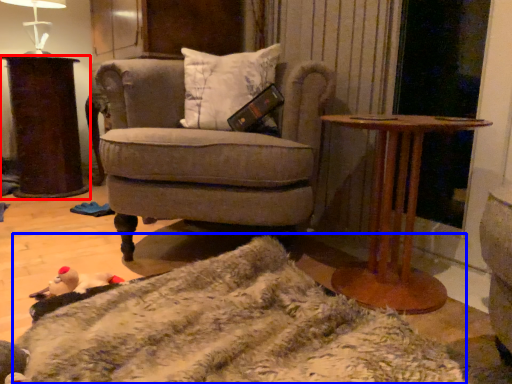
Question: Which object is closer to the camera taking this photo, desk (highlighted by a red box) or blanket (highlighted by a blue box)?

Choices:
 (A) desk
 (B) blanket

Answer: (B)